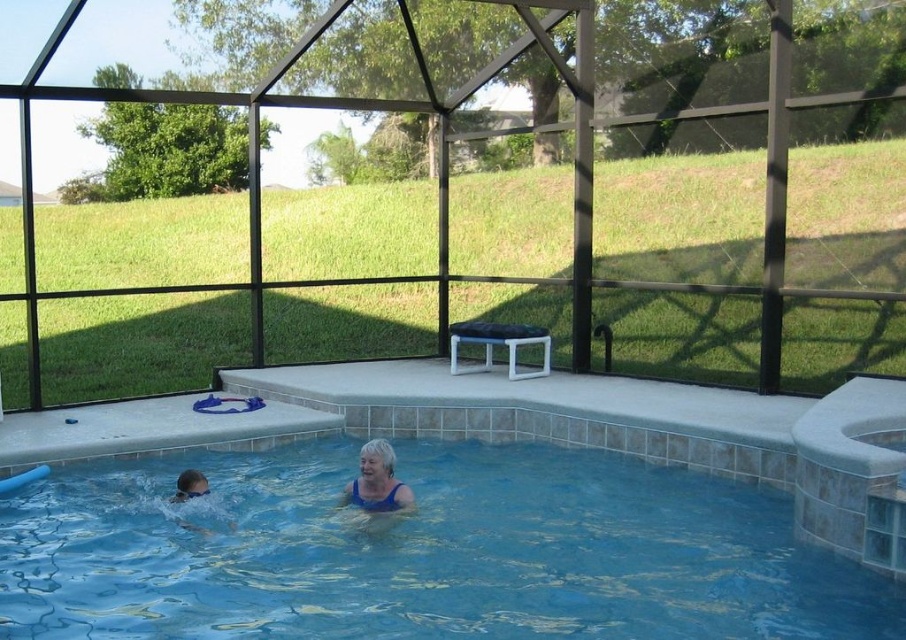
Question: Which object appears closest to the camera in this image?

Choices:
 (A) smooth blue swim cap at lower left
 (B) blue glossy water at center

Answer: (B)

Question: Which of the following is the farthest from the observer?

Choices:
 (A) (272, 461)
 (B) (204, 490)

Answer: (A)

Question: Can you confirm if blue glossy water at center is thinner than smooth blue swim cap at lower left?

Choices:
 (A) no
 (B) yes

Answer: (A)

Question: Considering the relative positions of blue glossy water at center and smooth blue swim cap at lower left in the image provided, where is blue glossy water at center located with respect to smooth blue swim cap at lower left?

Choices:
 (A) above
 (B) below

Answer: (B)

Question: Which of the following is the farthest from the observer?

Choices:
 (A) blue fabric person at center
 (B) blue glossy water at center
 (C) smooth blue swim cap at lower left

Answer: (C)

Question: Observing the image, what is the correct spatial positioning of blue glossy water at center in reference to smooth blue swim cap at lower left?

Choices:
 (A) right
 (B) left

Answer: (A)